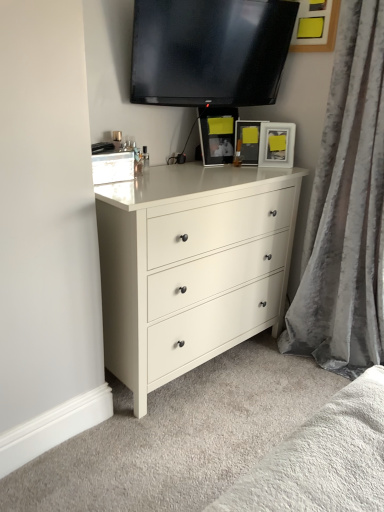
Locate an element on the screen. This screenshot has width=384, height=512. vacant space in front of matte black picture frame at upper center, marked as the first picture frame in a left-to-right arrangement is located at coordinates (221, 169).